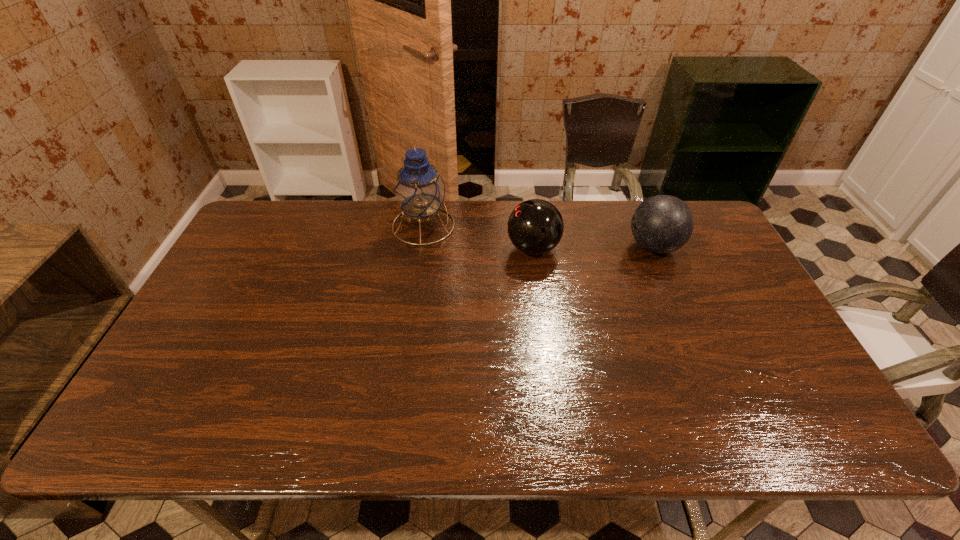
Where is `unoccupied area between the right bowling ball and the left bowling ball`? The image size is (960, 540). unoccupied area between the right bowling ball and the left bowling ball is located at coordinates (593, 247).

The height and width of the screenshot is (540, 960). I want to click on free space between the lantern and the second object from left to right, so click(478, 237).

Where is `unoccupied area between the rightmost object and the second object from left to right`? This screenshot has height=540, width=960. unoccupied area between the rightmost object and the second object from left to right is located at coordinates (593, 247).

This screenshot has width=960, height=540. Identify the location of empty space between the second object from right to left and the tallest object. (478, 237).

The image size is (960, 540). I want to click on vacant point located between the left bowling ball and the leftmost object, so 478,237.

At what (x,y) coordinates should I click in order to perform the action: click on free area in between the lantern and the second object from right to left. Please return your answer as a coordinate pair (x, y). Looking at the image, I should click on (478, 237).

This screenshot has width=960, height=540. What are the coordinates of `free space between the left bowling ball and the rightmost object` in the screenshot? It's located at (593, 247).

Locate an element on the screen. the second closest object relative to the right bowling ball is located at coordinates (419, 190).

I want to click on object that stands as the second closest to the rightmost object, so click(419, 190).